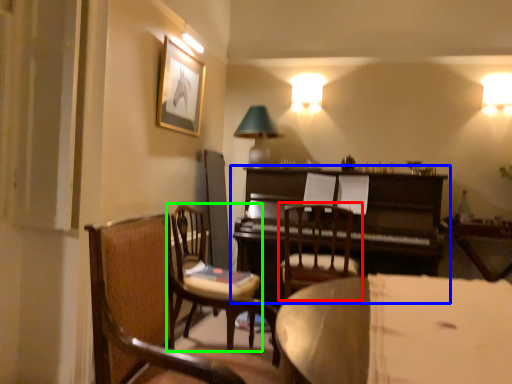
Question: Estimate the real-world distances between objects in this image. Which object is closer to chair (highlighted by a red box), piano (highlighted by a blue box) or chair (highlighted by a green box)?

Choices:
 (A) piano
 (B) chair

Answer: (A)